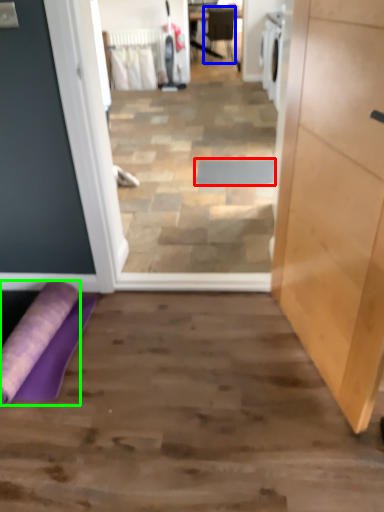
Question: Considering the real-world distances, which object is closest to doormat (highlighted by a red box)? chair (highlighted by a blue box) or beach towel (highlighted by a green box).

Choices:
 (A) chair
 (B) beach towel

Answer: (B)